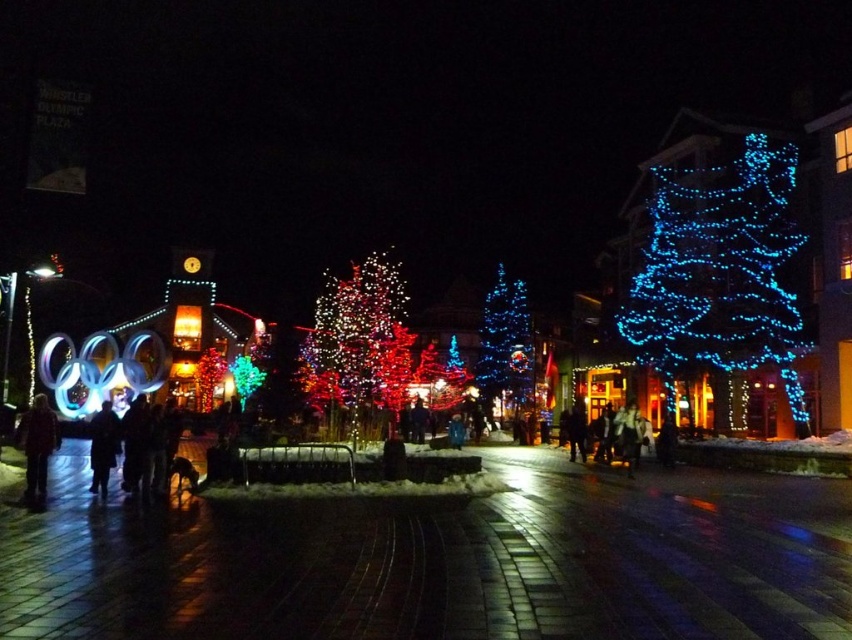
You are standing in the plaza and want to take a photo of both the illuminated red tree at center and the blue led lights at center. Since you want them both in the frame, which object should you position closer to the camera to ensure both are visible?

The illuminated red tree at center is positioned on the left side of blue led lights at center. To capture both in the frame, position yourself so that the red tree is closer to the camera while keeping the blue LED lights within the same field of view.

You are a photographer trying to capture a photo of both the blue led lights at center and the dark gray jacket at center from a standing position. Which object should you focus on first if you want to ensure both are in focus without adjusting your camera settings?

You should focus on the blue led lights at center first because it is taller than the dark gray jacket at center, so focusing on the taller object will help keep both in focus.